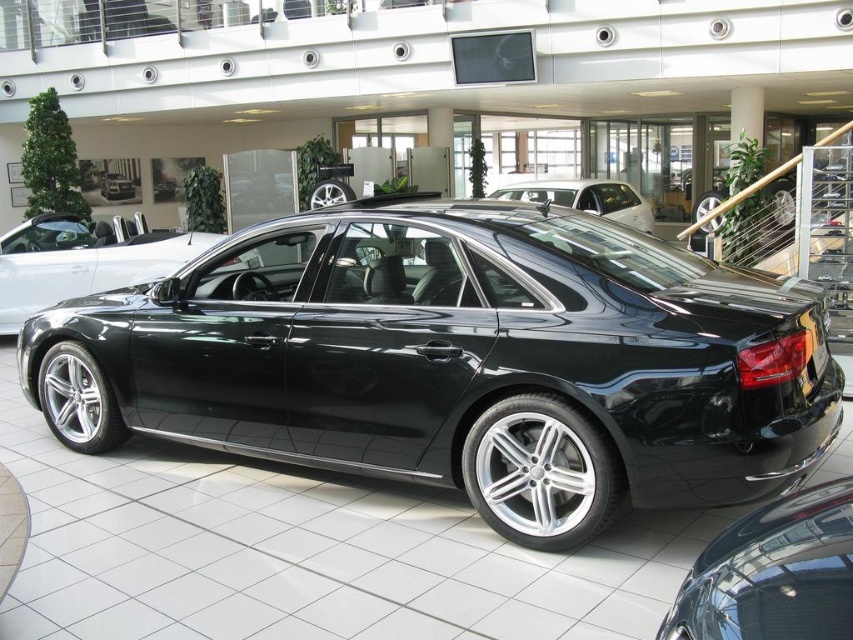
You are standing in the car showroom and want to take a photo of the black sedan. You notice two points marked on the floor at coordinates point (850, 545) and point (22, 266). Which point is better for taking a clear photo of the entire car without any obstructions?

Point (850, 545) is closer to the camera than point (22, 266), so it would be better for taking a clear photo of the entire car without obstructions because it is nearer to the camera position.